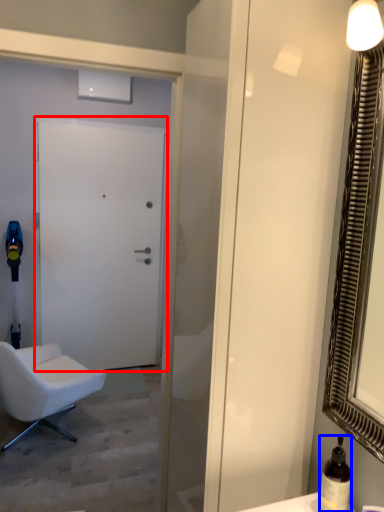
Question: Which of the following is the closest to the observer, door (highlighted by a red box) or bottle (highlighted by a blue box)?

Choices:
 (A) door
 (B) bottle

Answer: (B)